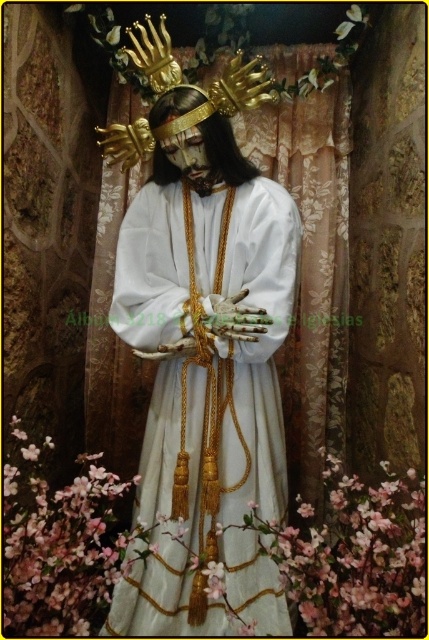
Is point (250, 209) in front of point (218, 138)?

No, (250, 209) is further to viewer.

Does white satin dress at center have a lesser height compared to matte gold crown at center?

Incorrect, white satin dress at center's height does not fall short of matte gold crown at center's.

Is point (190, 531) farther from viewer compared to point (148, 125)?

No, (190, 531) is closer to viewer.

In order to click on white satin dress at center in this screenshot , I will do `click(213, 369)`.

Between white satin dress at center and gold metallic crown at upper center, which one has more height?

white satin dress at center

This screenshot has width=429, height=640. What do you see at coordinates (213, 369) in the screenshot?
I see `white satin dress at center` at bounding box center [213, 369].

Locate an element on the screen. The width and height of the screenshot is (429, 640). white satin dress at center is located at coordinates pyautogui.click(x=213, y=369).

Does point (169, 45) come behind point (226, 150)?

No, it is not.

Does gold metallic crown at upper center appear under matte gold crown at center?

No.

Is point (142, 36) more distant than point (166, 113)?

No, (142, 36) is closer to viewer.

This screenshot has height=640, width=429. What are the coordinates of `gold metallic crown at upper center` in the screenshot? It's located at (180, 88).